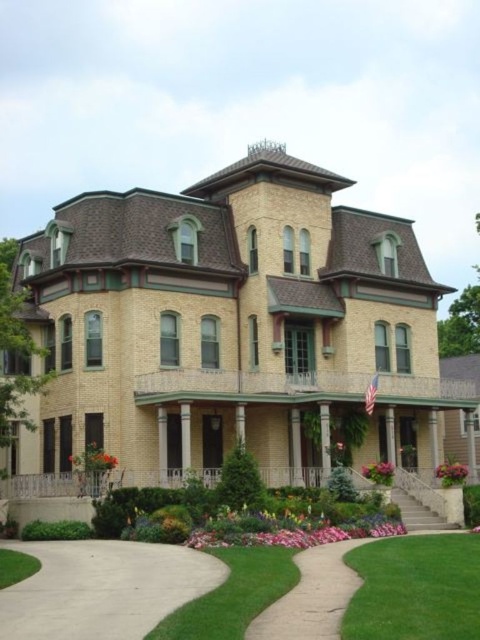
You are a delivery person with a cart that is 2 meters wide. You need to deliver a package to the house. The cart must stay on the light beige concrete driveway at lower center and avoid the pink matte flower at center. Is there enough space between them for your cart to pass safely?

The light beige concrete driveway at lower center and pink matte flower at center are 24.04 meters apart from each other. Since the cart is only 2 meters wide, there is sufficient space between them for the cart to pass safely without hitting the pink matte flower at center.

You are a delivery person approaching the house and need to place a package on the ground near the light beige concrete driveway at lower center and the pink matte flower at center. Which object is higher and thus more suitable for placing the package to avoid water accumulation during rain?

The light beige concrete driveway at lower center has a greater height compared to the pink matte flower at center, so placing the package there would be better to avoid water accumulation during rain.